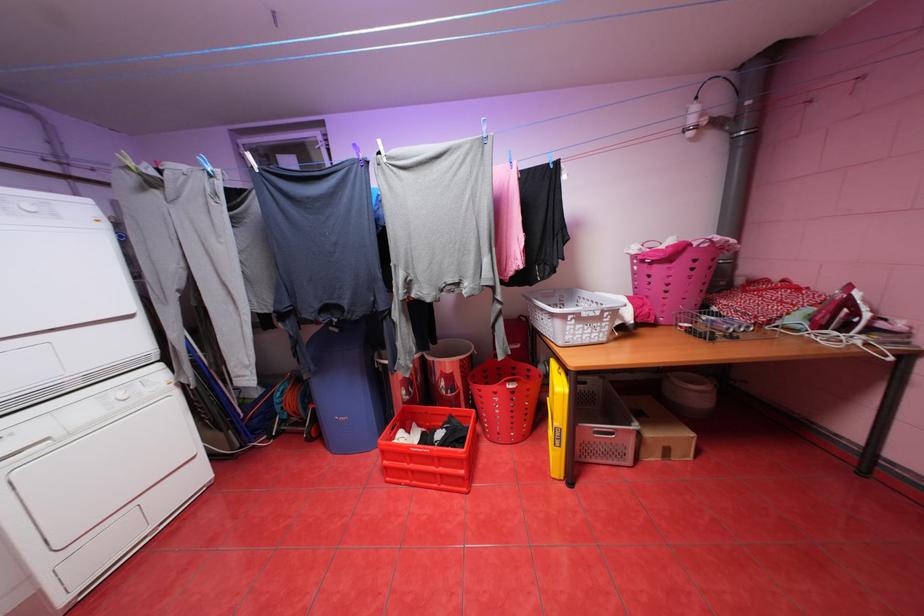
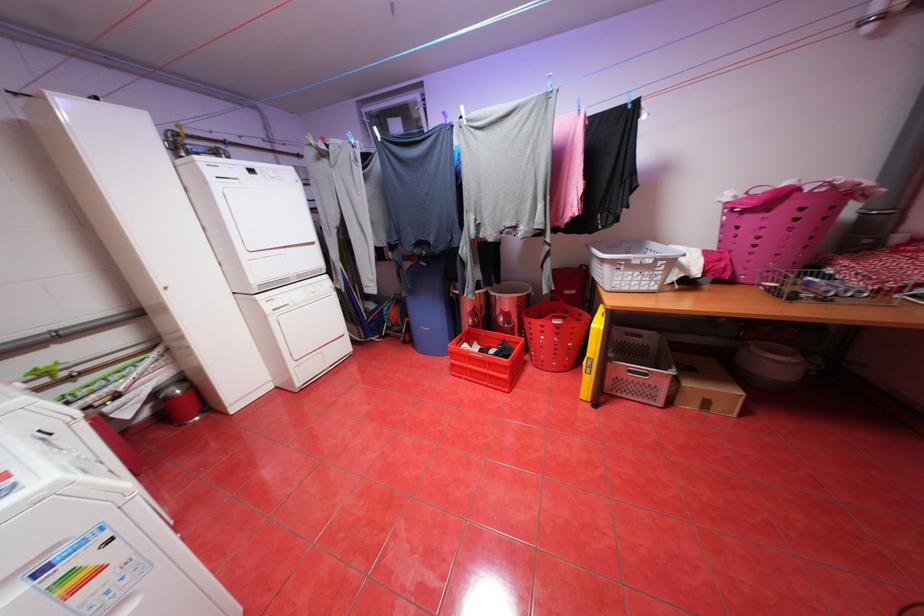
In the second image, find the point that corresponds to (x=428, y=424) in the first image.

(488, 344)